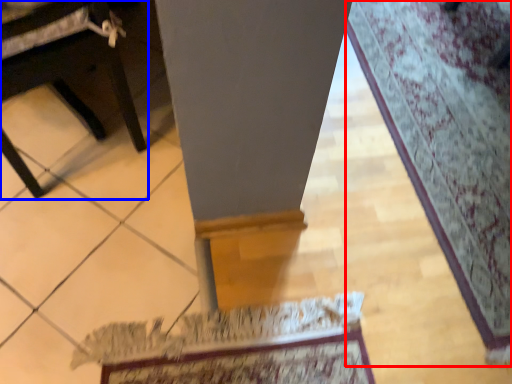
Question: Among these objects, which one is farthest to the camera, mat (highlighted by a red box) or furniture (highlighted by a blue box)?

Choices:
 (A) mat
 (B) furniture

Answer: (A)